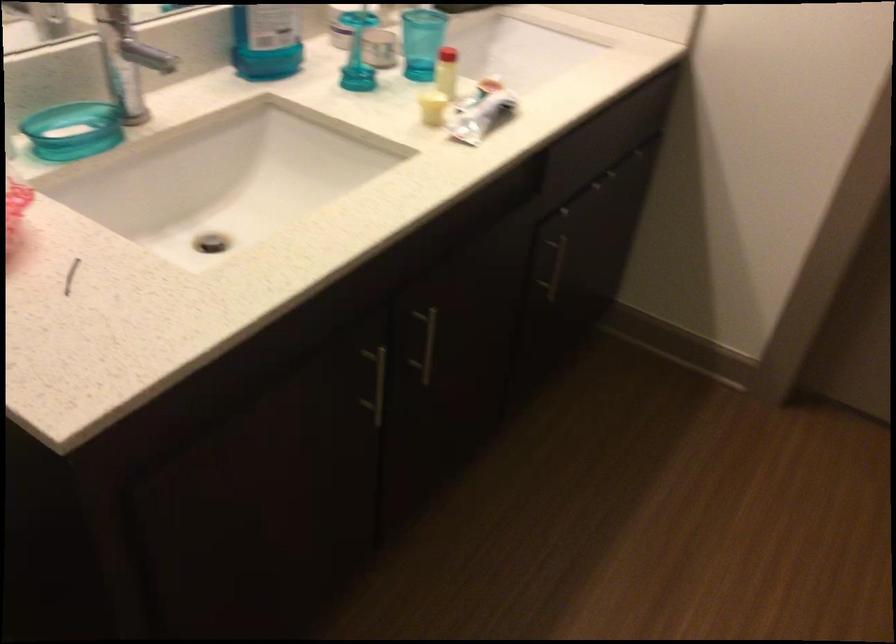
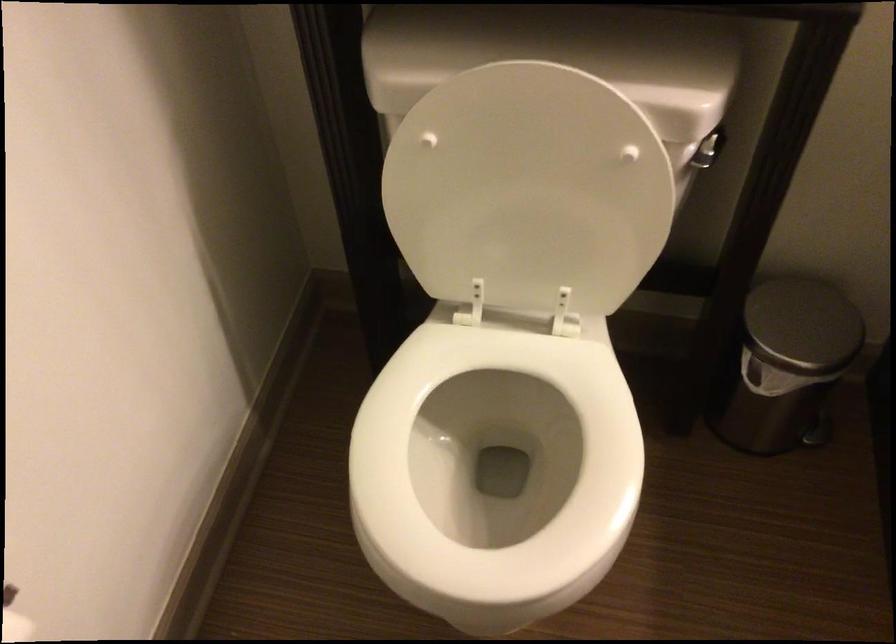
Consider the image. Based on the continuous images, in which direction is the camera rotating?

The rotation direction of the camera is left-down.